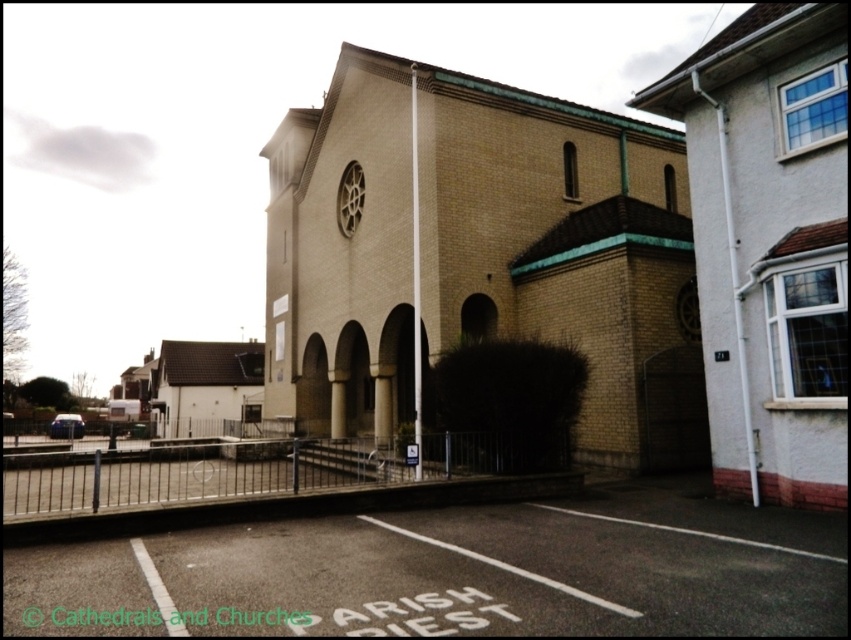
You are standing at the entrance of the modern church and want to find the dark asphalt parking lot at lower center. Based on the coordinates provided, in which direction should you look to locate it?

The dark asphalt parking lot at lower center is located at coordinates point (455, 573), so you should look towards the lower center direction to locate it.

You are standing in front of the beige brick church at center and the matte brick church at right. Which one is closer to you?

The beige brick church at center is closer to you than the matte brick church at right.